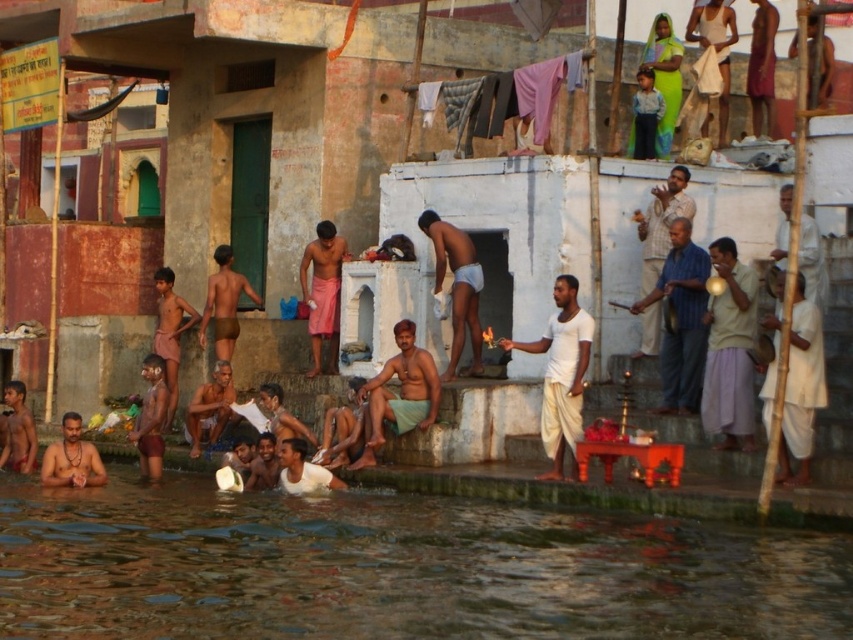
Can you confirm if brown skin man at lower left is bigger than brown skin man at lower center?

Yes.

Is point (42, 484) closer to viewer compared to point (215, 385)?

Yes.

What do you see at coordinates (71, 458) in the screenshot? The height and width of the screenshot is (640, 853). I see `brown skin man at lower left` at bounding box center [71, 458].

You are a GUI agent. You are given a task and a screenshot of the screen. Output one action in this format:
    pyautogui.click(x=<x>, y=<y>)
    Task: Click on the brown skin man at lower left
    This screenshot has height=640, width=853.
    Given the screenshot: What is the action you would take?
    pyautogui.click(x=71, y=458)

Who is positioned more to the right, white cotton dhoti at lower center or light brown cotton shirt at center?

From the viewer's perspective, light brown cotton shirt at center appears more on the right side.

Is white cotton dhoti at lower center below light brown cotton shirt at center?

Yes.

Is point (553, 394) less distant than point (657, 339)?

Yes.

Locate an element on the screen. white cotton dhoti at lower center is located at coordinates (561, 372).

Is light brown cotton shirt at center smaller than brown skin man at lower left?

Correct, light brown cotton shirt at center occupies less space than brown skin man at lower left.

Who is shorter, light brown cotton shirt at center or brown skin man at lower left?

With less height is light brown cotton shirt at center.

Where is `light brown cotton shirt at center`? light brown cotton shirt at center is located at coordinates (660, 224).